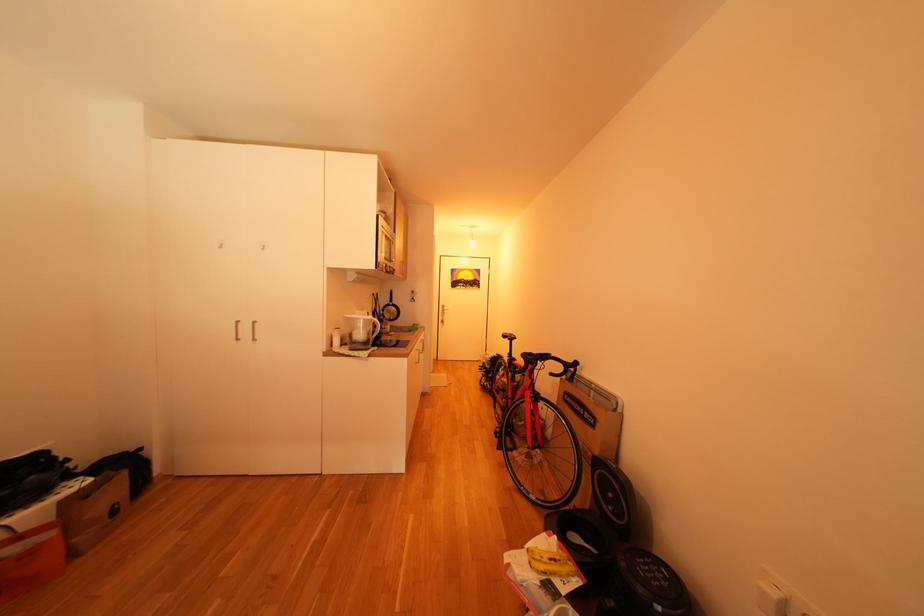
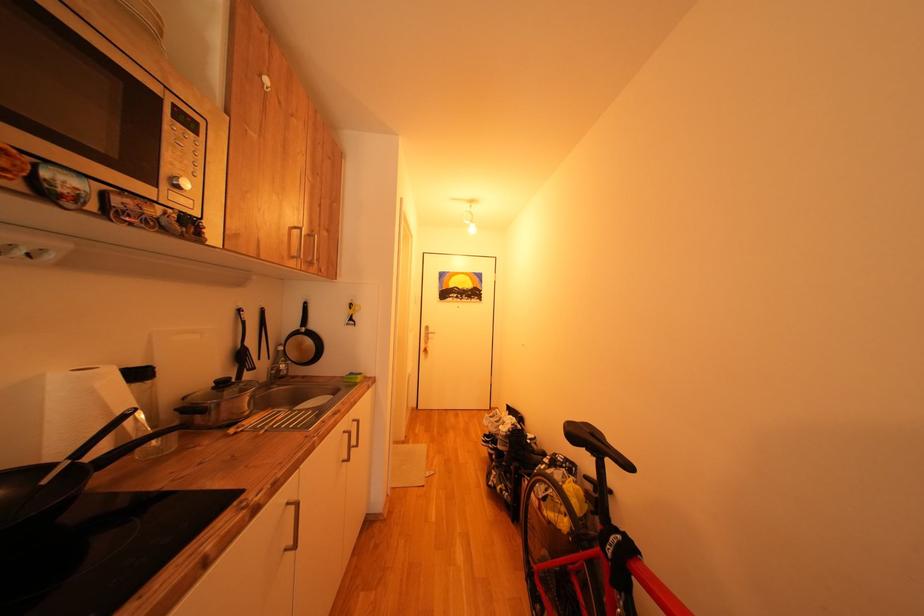
Question: The images are taken continuously from a first-person perspective. In which direction are you moving?

Choices:
 (A) Left
 (B) Right
 (C) Forward
 (D) Backward

Answer: (C)